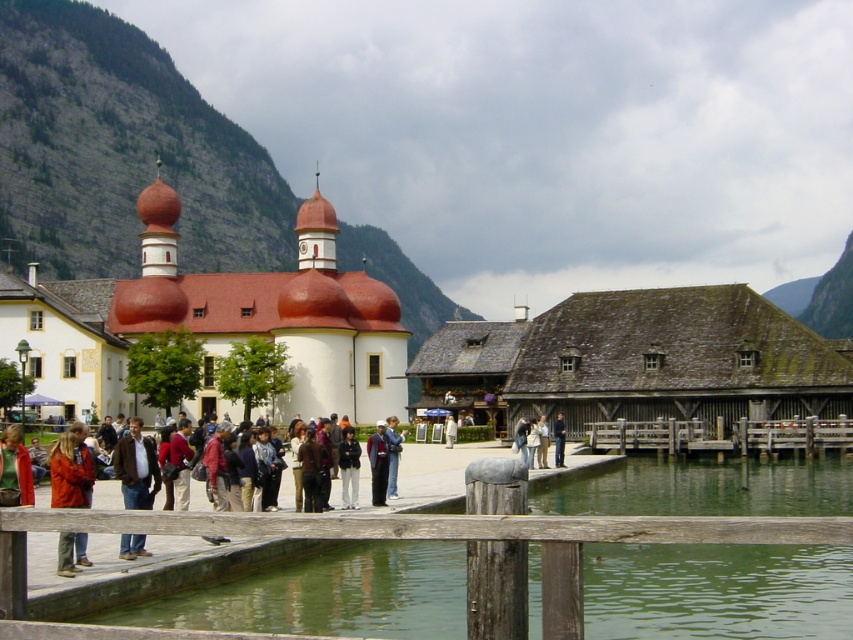
Question: Which object is positioned farthest from the rugged stone mountain at upper left?

Choices:
 (A) wooden dock at lower center
 (B) dark blue suit at center
 (C) blue denim jacket at center
 (D) brown leather jacket at lower left

Answer: (D)

Question: Among these points, which one is farthest from the camera?

Choices:
 (A) (834, 429)
 (B) (108, 381)
 (C) (386, 445)
 (D) (601, 333)

Answer: (B)

Question: Is brown leather jacket at lower left positioned before blue denim jacket at center?

Choices:
 (A) yes
 (B) no

Answer: (A)

Question: Does dark blue suit at center have a larger size compared to denim jacket at center?

Choices:
 (A) yes
 (B) no

Answer: (A)

Question: Among these objects, which one is farthest from the camera?

Choices:
 (A) light brown leather jacket at center
 (B) blue denim jacket at center
 (C) rugged stone mountain at upper left
 (D) denim jacket at center

Answer: (C)

Question: Does dark blue suit at center have a larger size compared to light brown leather jacket at center?

Choices:
 (A) yes
 (B) no

Answer: (A)